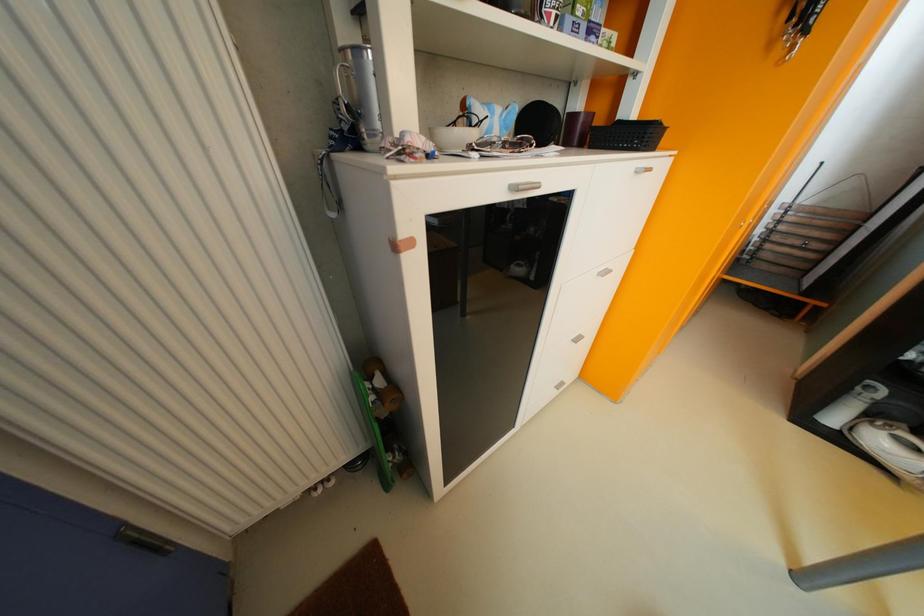
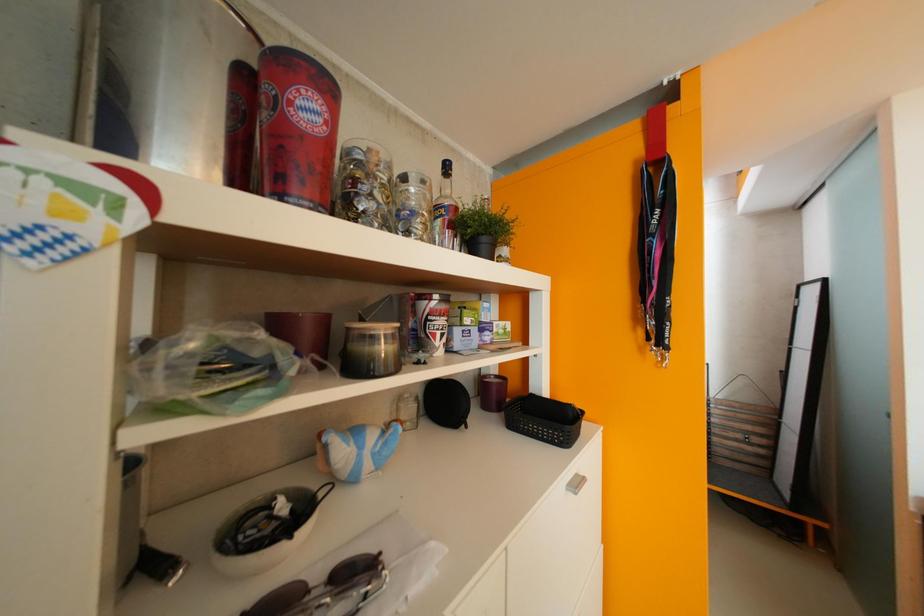
Question: Based on the continuous images, in which direction is the camera rotating? Reply with the corresponding letter.

Choices:
 (A) Left
 (B) Right
 (C) Up
 (D) Down

Answer: (C)